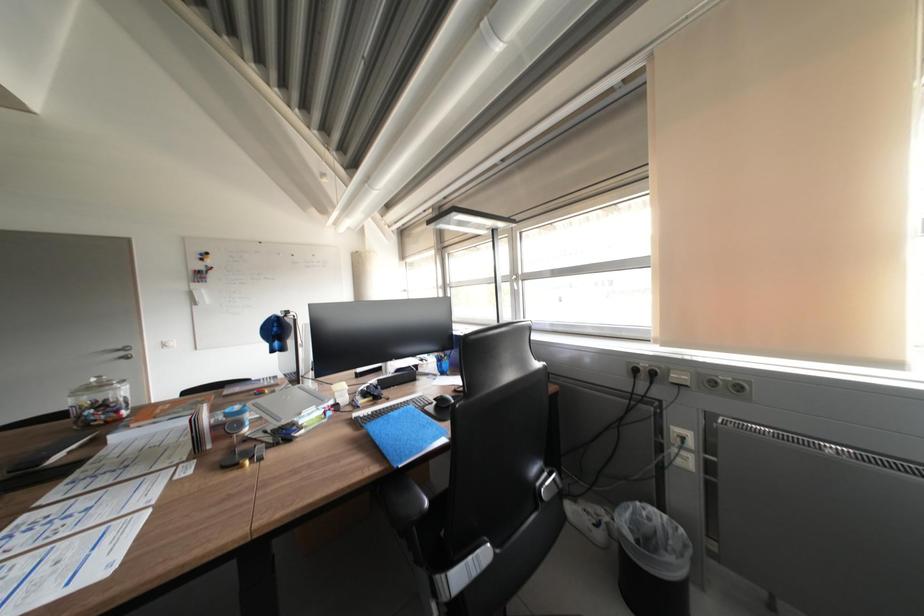
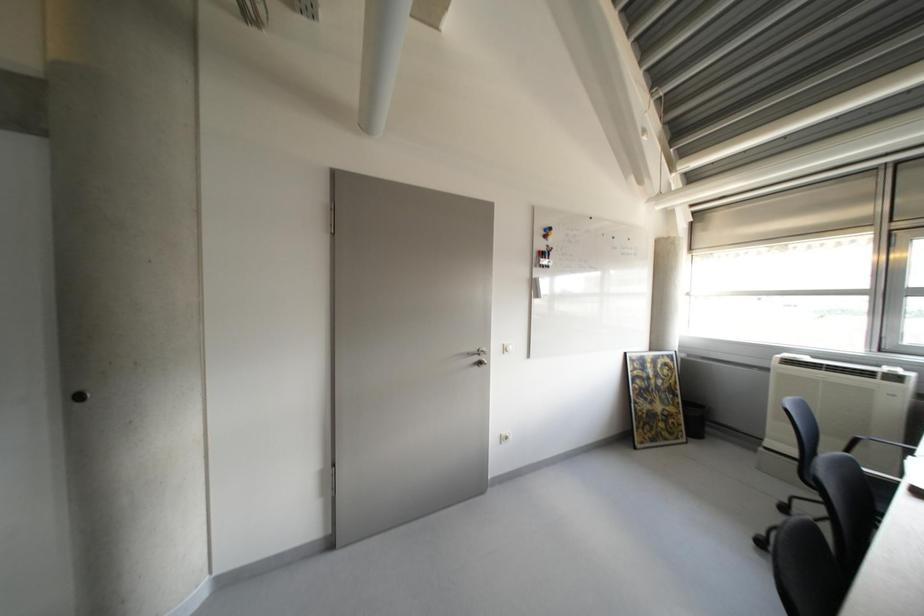
Question: What movement of the cameraman would produce the second image?

Choices:
 (A) Left
 (B) Right
 (C) Forward
 (D) Backward

Answer: (A)